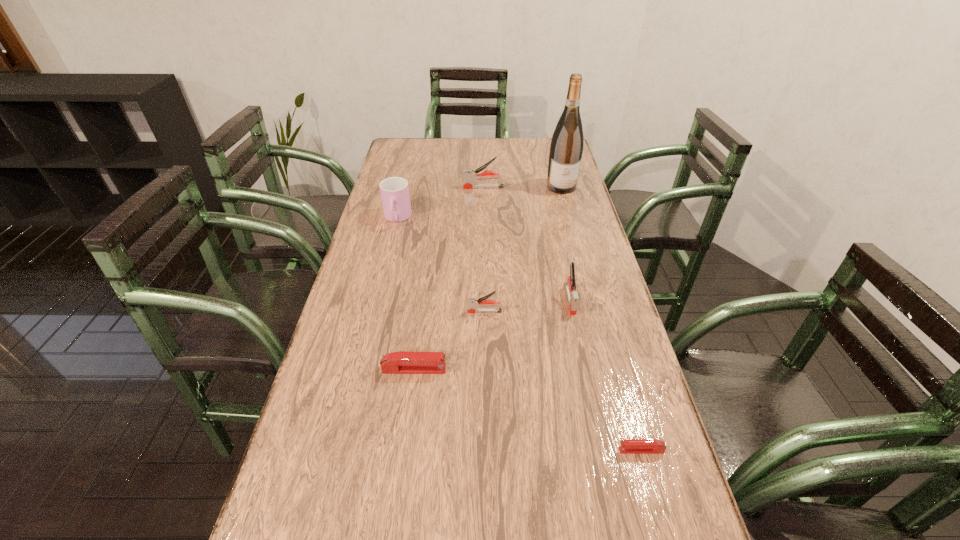
At what (x,y) coordinates should I click in order to perform the action: click on free space at the left edge of the desktop. Please return your answer as a coordinate pair (x, y). The height and width of the screenshot is (540, 960). Looking at the image, I should click on (351, 512).

At what (x,y) coordinates should I click in order to perform the action: click on free space at the right edge of the desktop. Please return your answer as a coordinate pair (x, y). Image resolution: width=960 pixels, height=540 pixels. Looking at the image, I should click on (539, 171).

At what (x,y) coordinates should I click in order to perform the action: click on vacant space at the far left corner of the desktop. Please return your answer as a coordinate pair (x, y). Looking at the image, I should click on (423, 151).

This screenshot has width=960, height=540. In order to click on vacant space at the far right corner of the desktop in this screenshot , I will do `click(548, 151)`.

What are the coordinates of `vacant area that lies between the smallest gray stapler and the fourth farthest stapler` in the screenshot? It's located at 449,341.

Identify the location of vacant space in between the farthest stapler and the fifth tallest object. (484, 249).

Image resolution: width=960 pixels, height=540 pixels. I want to click on free space between the rightmost gray stapler and the third tallest stapler, so click(x=527, y=305).

This screenshot has height=540, width=960. What are the coordinates of `free spot between the smaller red stapler and the fifth nearest object` in the screenshot? It's located at (519, 334).

Identify the location of vacant point located between the tallest object and the right red stapler. (601, 319).

You are a GUI agent. You are given a task and a screenshot of the screen. Output one action in this format:
    pyautogui.click(x=<x>, y=<y>)
    Task: Click on the free spot between the second nearest stapler and the brown wine bottle
    The height and width of the screenshot is (540, 960).
    Given the screenshot: What is the action you would take?
    pyautogui.click(x=488, y=278)